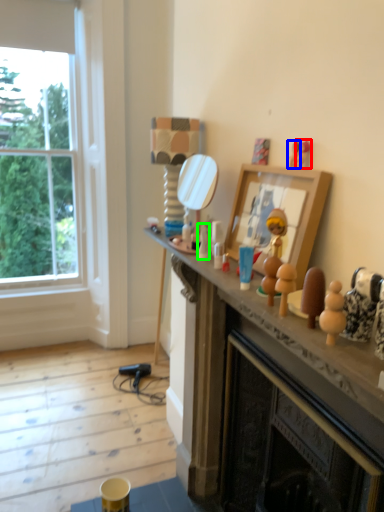
Question: Estimate the real-world distances between objects in this image. Which object is closer to toy (highlighted by a red box), toy (highlighted by a blue box) or toy (highlighted by a green box)?

Choices:
 (A) toy
 (B) toy

Answer: (A)